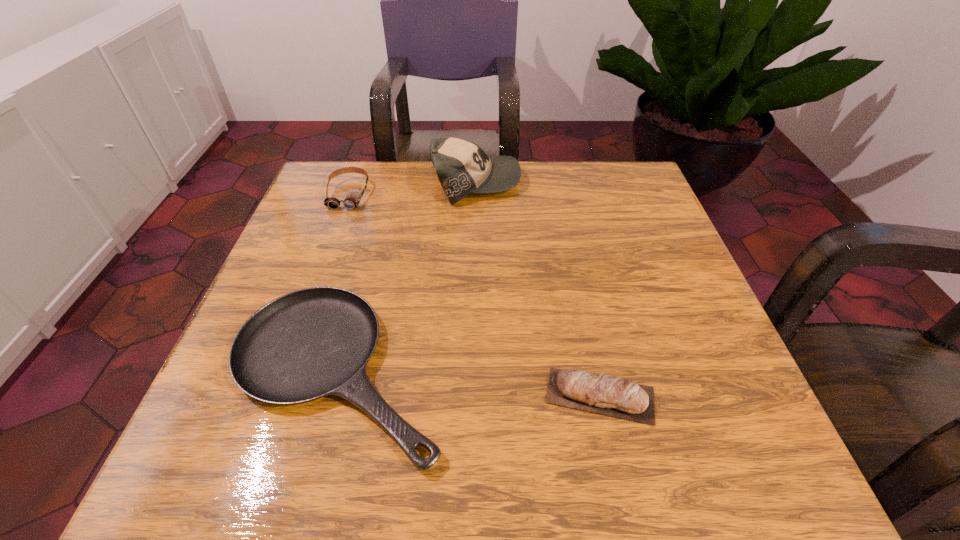
The width and height of the screenshot is (960, 540). What are the coordinates of `pita bread located at the near edge` in the screenshot? It's located at (613, 396).

I want to click on frying pan situated at the near edge, so pos(307,344).

Where is `goggles present at the left edge`? This screenshot has height=540, width=960. goggles present at the left edge is located at coordinates (352, 200).

Identify the location of frying pan positioned at the left edge. The height and width of the screenshot is (540, 960). (307, 344).

You are a GUI agent. You are given a task and a screenshot of the screen. Output one action in this format:
    pyautogui.click(x=<x>, y=<y>)
    Task: Click on the object positioned at the right edge
    The image size is (960, 540).
    Given the screenshot: What is the action you would take?
    pyautogui.click(x=613, y=396)

In order to click on object that is at the far left corner in this screenshot , I will do `click(352, 200)`.

The image size is (960, 540). I want to click on object at the near left corner, so click(307, 344).

Find the location of a particular element. The height and width of the screenshot is (540, 960). object that is at the near right corner is located at coordinates (613, 396).

In the image, there is a desktop. At what (x,y) coordinates should I click in order to perform the action: click on free region at the far edge. Please return your answer as a coordinate pair (x, y). Looking at the image, I should click on (433, 179).

Image resolution: width=960 pixels, height=540 pixels. In order to click on vacant space at the near edge of the desktop in this screenshot , I will do (x=573, y=468).